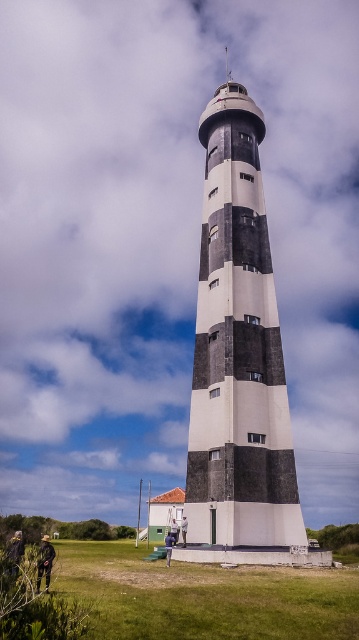
Question: Which point is farther to the camera?

Choices:
 (A) (213, 120)
 (B) (171, 592)

Answer: (A)

Question: From the image, what is the correct spatial relationship of black and white striped lighthouse at center in relation to green grass at lower center?

Choices:
 (A) below
 (B) above

Answer: (B)

Question: Which point appears farthest from the camera in this image?

Choices:
 (A) (156, 593)
 (B) (235, 294)

Answer: (B)

Question: Among these points, which one is nearest to the camera?

Choices:
 (A) (225, 257)
 (B) (315, 573)

Answer: (B)

Question: Does black and white striped lighthouse at center appear on the right side of green grass at lower center?

Choices:
 (A) no
 (B) yes

Answer: (B)

Question: Is black and white striped lighthouse at center above green grass at lower center?

Choices:
 (A) no
 (B) yes

Answer: (B)